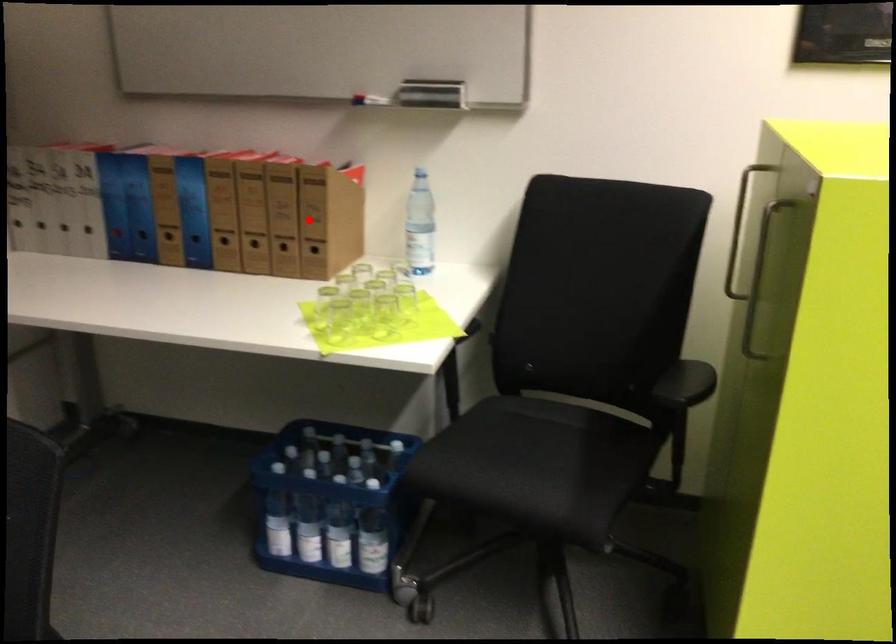
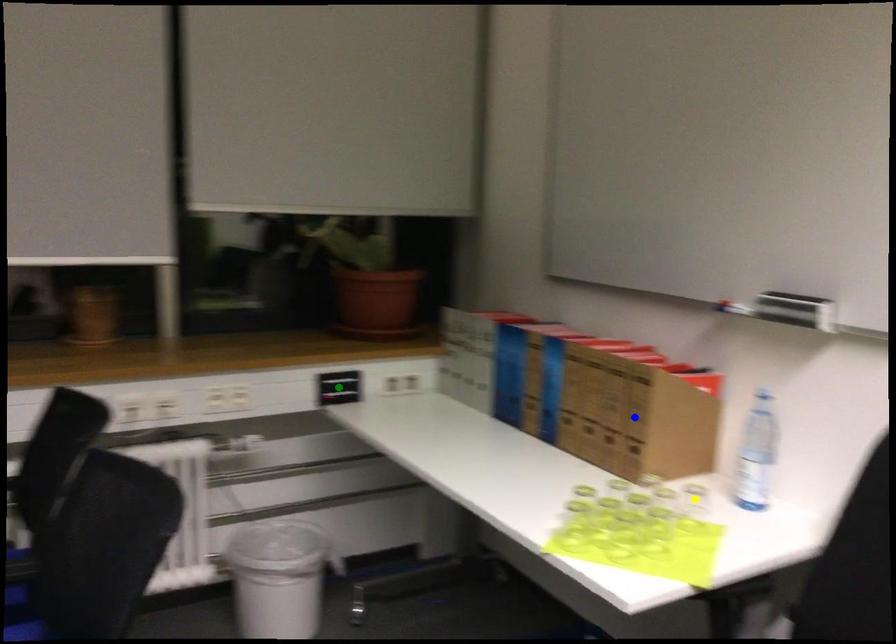
Question: I am providing you with two images of the same scene from different viewpoints. A red point is marked on the first image. You are given multiple points on the second image. Which point in image 2 represents the same 3d spot as the red point in image 1?

Choices:
 (A) blue point
 (B) green point
 (C) yellow point

Answer: (A)